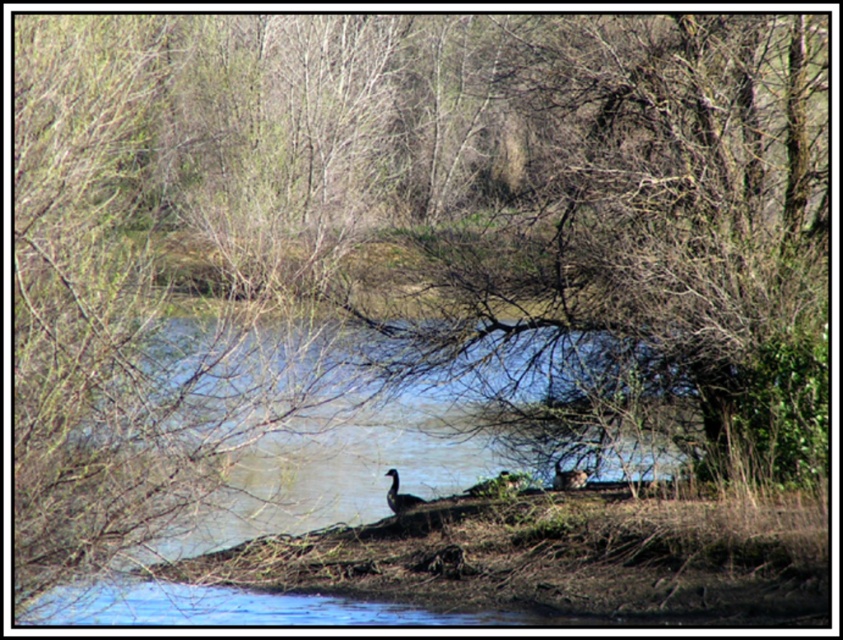
From the picture: You are an environmental scientist studying water bodies. You observe the clear blue water at center and the brown matte duck at center in the scene. Which of these two has a greater width?

The clear blue water at center has a greater width than the brown matte duck at center.

You are observing two ducks in the water. The dark gray duck at center and the brown matte duck at center. Which duck is closer to the surface of the water?

Answer: The dark gray duck at center is positioned under the brown matte duck at center, so the brown matte duck at center is closer to the surface of the water.